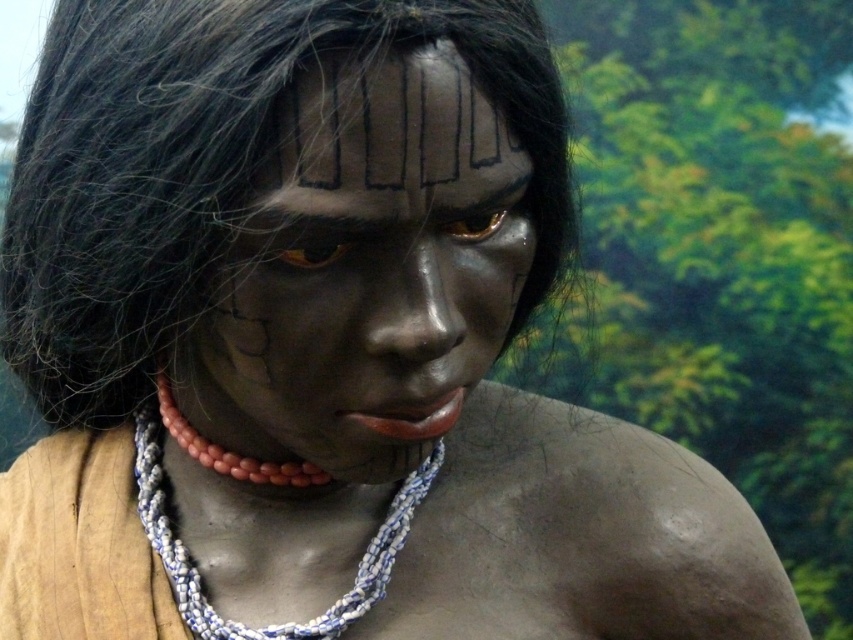
Question: Which point is closer to the camera?

Choices:
 (A) black matte forehead at center
 (B) matte black face at center
 (C) blue and white beaded necklace at center

Answer: (B)

Question: Can you confirm if black matte forehead at center is bigger than blue and white beaded necklace at center?

Choices:
 (A) yes
 (B) no

Answer: (B)

Question: Estimate the real-world distances between objects in this image. Which object is closer to the blue and white beaded necklace at center?

Choices:
 (A) matte black face at center
 (B) black matte forehead at center

Answer: (A)

Question: Can you confirm if black matte forehead at center is thinner than blue and white beaded necklace at center?

Choices:
 (A) no
 (B) yes

Answer: (B)

Question: Which point is farther to the camera?

Choices:
 (A) blue and white beaded necklace at center
 (B) matte black face at center

Answer: (A)

Question: Can you confirm if matte black face at center is positioned above blue and white beaded necklace at center?

Choices:
 (A) no
 (B) yes

Answer: (B)